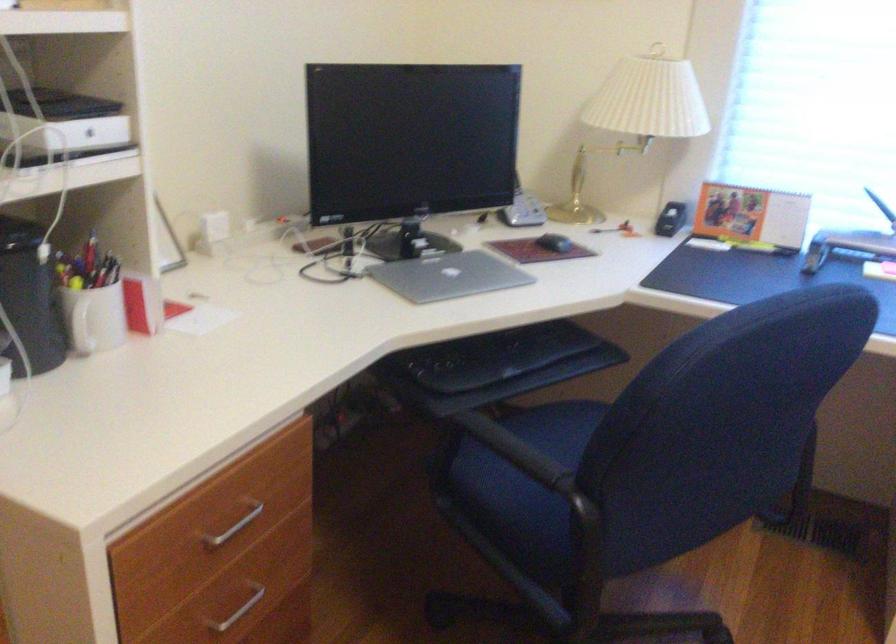
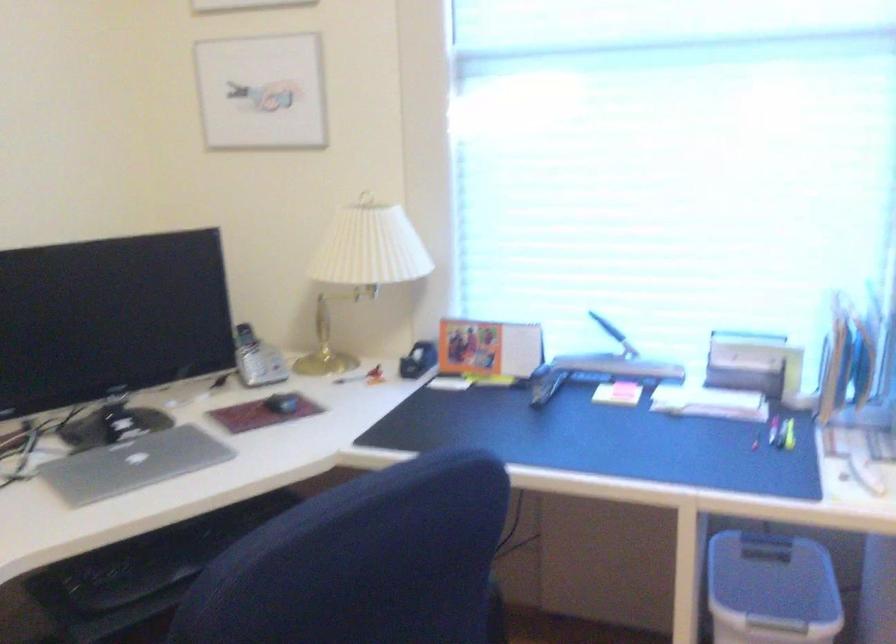
The point at (445, 276) is marked in the first image. Where is the corresponding point in the second image?

(133, 464)